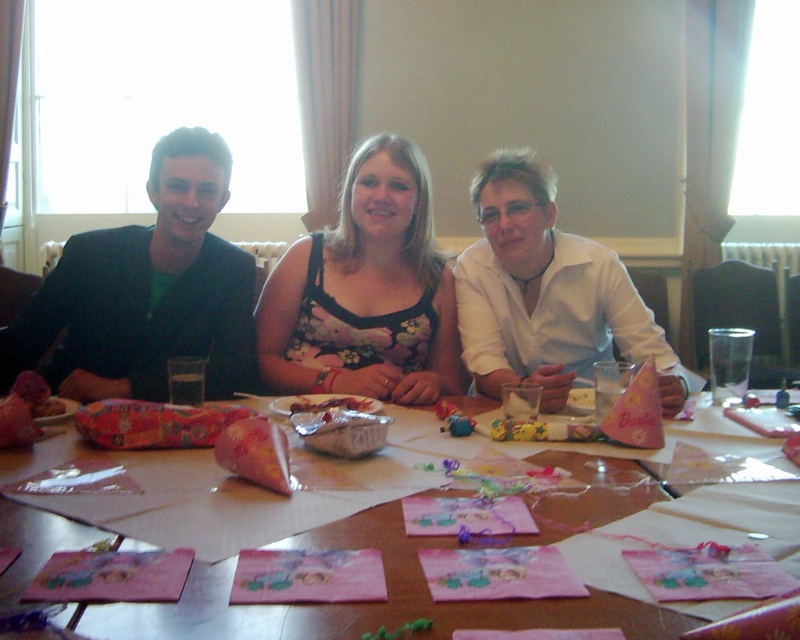
Question: Where is floral fabric dress at center located in relation to translucent plastic bag at center in the image?

Choices:
 (A) right
 (B) left

Answer: (A)

Question: Which object is the farthest from the black matte jacket at left?

Choices:
 (A) pink paper napkins at center
 (B) matte brown cake at lower left

Answer: (A)

Question: Which point is farther to the camera?

Choices:
 (A) black matte jacket at left
 (B) pink paper napkins at center

Answer: (A)

Question: Estimate the real-world distances between objects in this image. Which object is farther from the translucent plastic bag at center?

Choices:
 (A) black matte jacket at left
 (B) floral fabric dress at center
 (C) pink paper napkins at center

Answer: (A)

Question: Does pink paper napkins at center appear on the right side of floral fabric dress at center?

Choices:
 (A) no
 (B) yes

Answer: (A)

Question: Is the position of pink paper napkins at center less distant than that of matte brown cake at lower left?

Choices:
 (A) no
 (B) yes

Answer: (B)